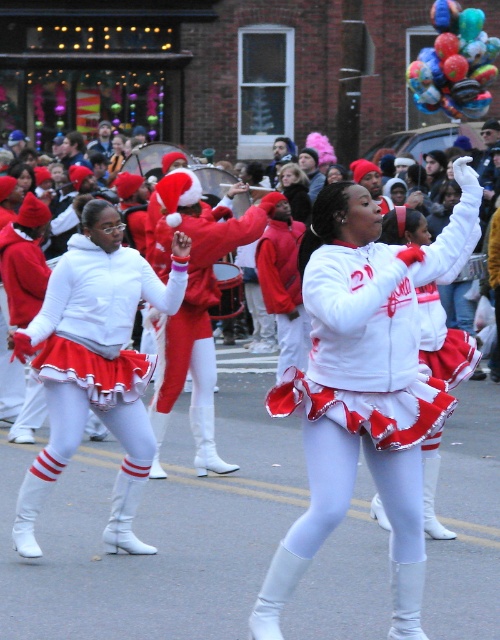
Where is `white matte cheerleader at center`? This screenshot has width=500, height=640. white matte cheerleader at center is located at coordinates (364, 388).

Locate an element on the screen. The width and height of the screenshot is (500, 640). white matte cheerleader at center is located at coordinates (364, 388).

The image size is (500, 640). What are the coordinates of `white matte cheerleader at center` in the screenshot? It's located at (364, 388).

Does white matte cheerleader at center have a lesser height compared to red velvet santa hat at center?

In fact, white matte cheerleader at center may be taller than red velvet santa hat at center.

Does white matte cheerleader at center have a greater height compared to red velvet santa hat at center?

Indeed, white matte cheerleader at center has a greater height compared to red velvet santa hat at center.

Is point (414, 572) farther from camera compared to point (177, 328)?

No, it is in front of (177, 328).

Find the location of a particular element. Image resolution: width=500 pixels, height=640 pixels. white matte cheerleader at center is located at coordinates (364, 388).

Is the position of white matte cheerleader at center more distant than that of white matte uniform at center?

No, white matte cheerleader at center is in front of white matte uniform at center.

Is point (267, 580) farther from viewer compared to point (302, 186)?

No, (267, 580) is closer to viewer.

You are a GUI agent. You are given a task and a screenshot of the screen. Output one action in this format:
    pyautogui.click(x=<x>, y=<y>)
    Task: Click on the white matte cheerleader at center
    The height and width of the screenshot is (640, 500).
    Given the screenshot: What is the action you would take?
    pyautogui.click(x=364, y=388)